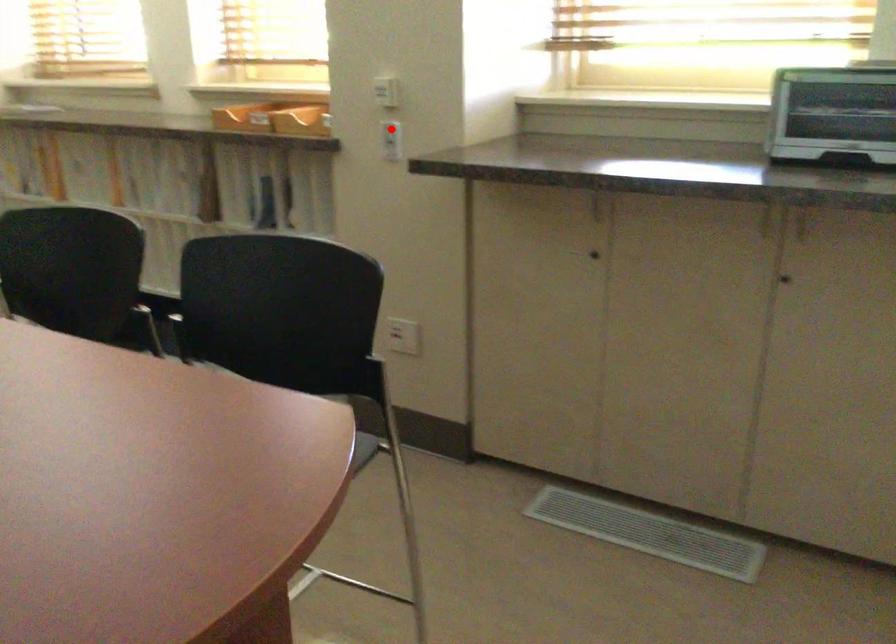
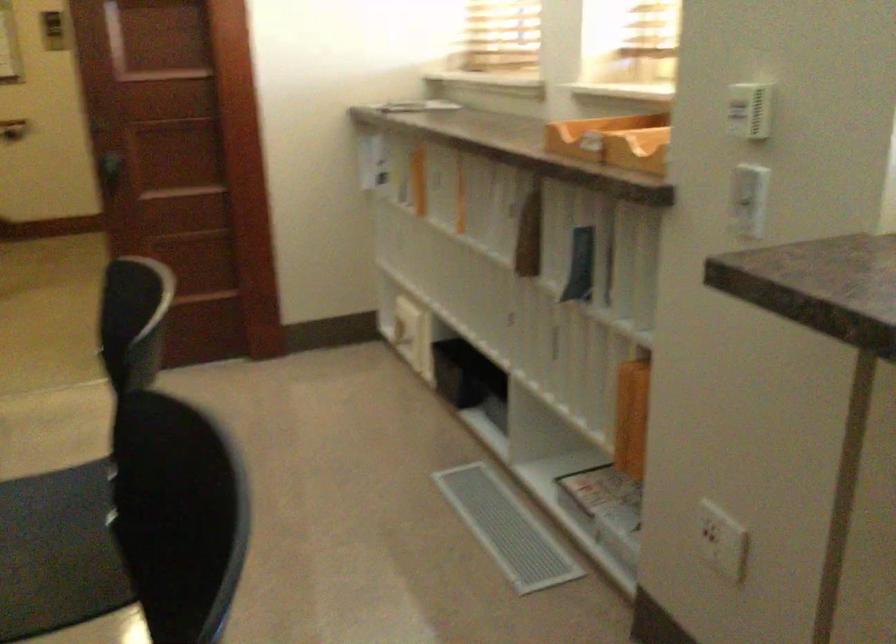
Question: A red point is marked in image1. In image2, is the corresponding 3D point closer to the camera or farther? Reply with the corresponding letter.

Choices:
 (A) The corresponding 3D point is closer.
 (B) The corresponding 3D point is farther.

Answer: (A)